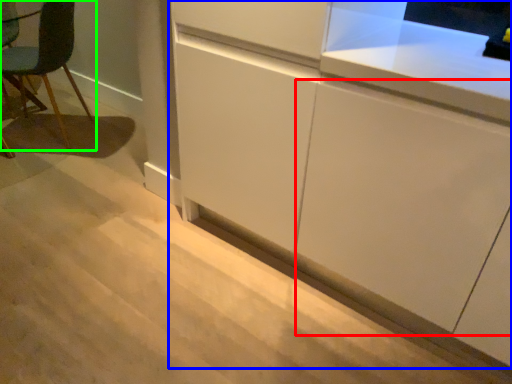
Question: Which is nearer to the cabinetry (highlighted by a red box)? cabinetry (highlighted by a blue box) or chair (highlighted by a green box).

Choices:
 (A) cabinetry
 (B) chair

Answer: (A)